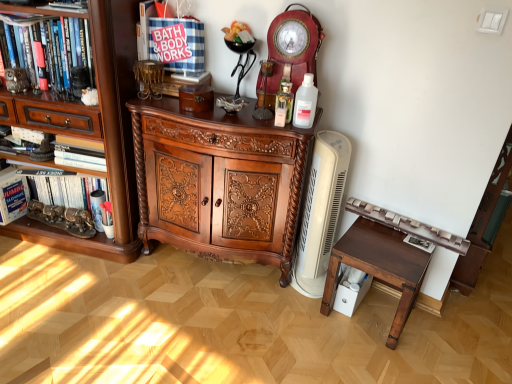
At what (x,y) coordinates should I click in order to perform the action: click on free region on the left part of white plastic heater at right. Please return your answer as a coordinate pair (x, y). This screenshot has height=384, width=512. Looking at the image, I should click on (269, 288).